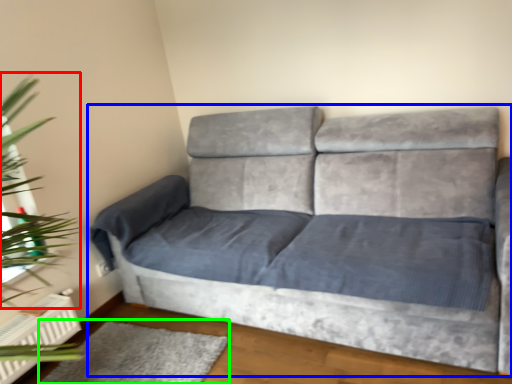
Question: Based on their relative distances, which object is farther from plant (highlighted by a red box)? Choose from studio couch (highlighted by a blue box) and mat (highlighted by a green box).

Choices:
 (A) studio couch
 (B) mat

Answer: (A)